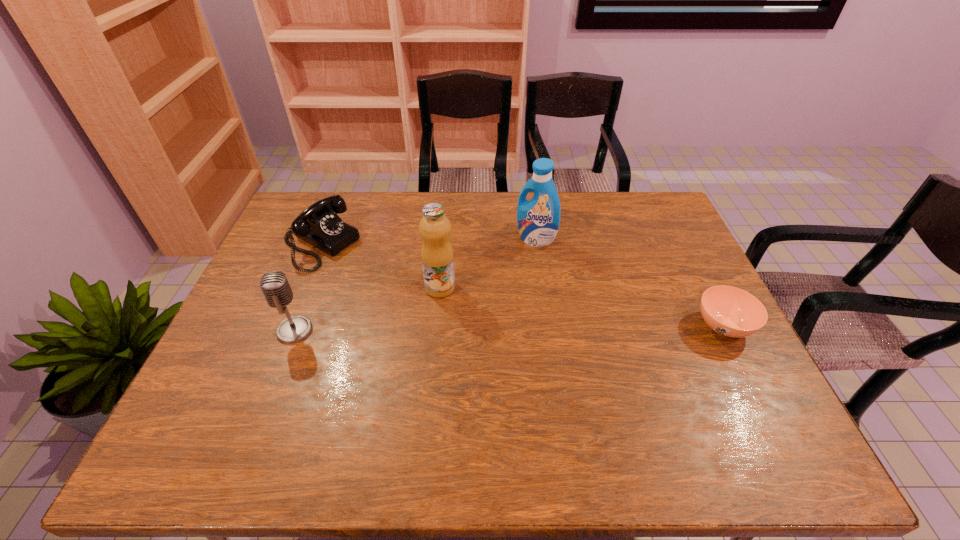
At what (x,y) coordinates should I click in order to perform the action: click on microphone that is at the left edge. Please return your answer as a coordinate pair (x, y). Looking at the image, I should click on (274, 285).

Locate an element on the screen. This screenshot has width=960, height=540. telephone present at the left edge is located at coordinates (319, 225).

Where is `object that is at the right edge`? The image size is (960, 540). object that is at the right edge is located at coordinates (732, 312).

Identify the location of object located in the far left corner section of the desktop. (319, 225).

The image size is (960, 540). I want to click on free region at the far edge of the desktop, so click(x=443, y=205).

This screenshot has width=960, height=540. Find the location of `vacant space at the near edge of the desktop`. vacant space at the near edge of the desktop is located at coordinates (514, 384).

Identify the location of vacant space at the left edge. (311, 273).

Locate an element on the screen. This screenshot has height=540, width=960. vacant space at the right edge of the desktop is located at coordinates (666, 253).

What are the coordinates of `vacant space at the far right corner of the desktop` in the screenshot? It's located at pos(636,217).

Locate an element on the screen. The image size is (960, 540). free spot between the third tallest object and the fourth object from left to right is located at coordinates (415, 285).